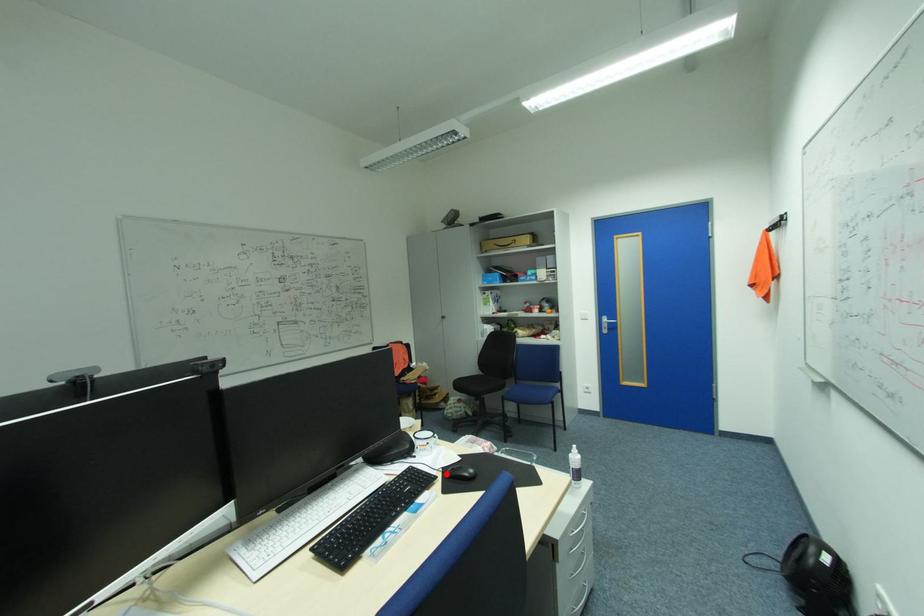
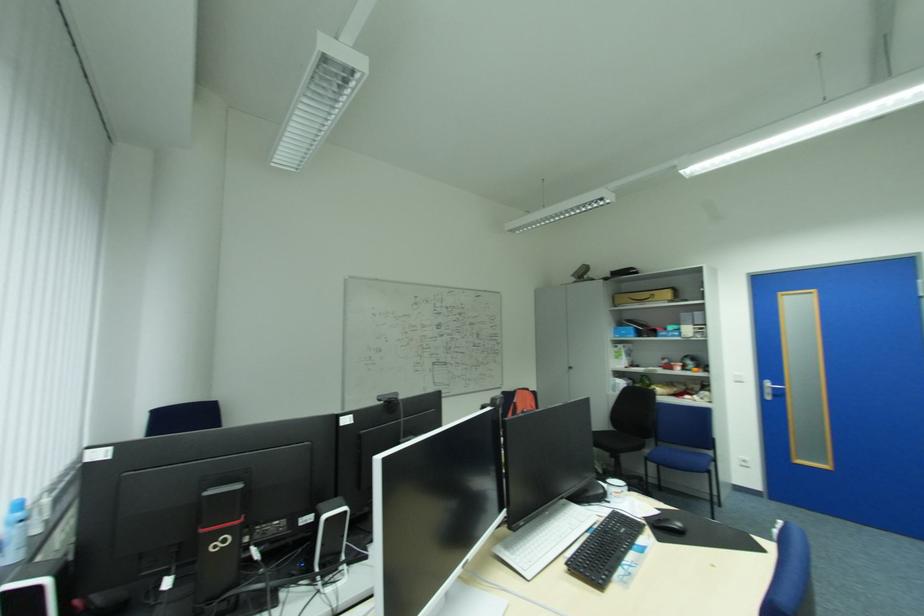
Find the pixel in the second image that matches the highlighted location in the first image.

(652, 524)